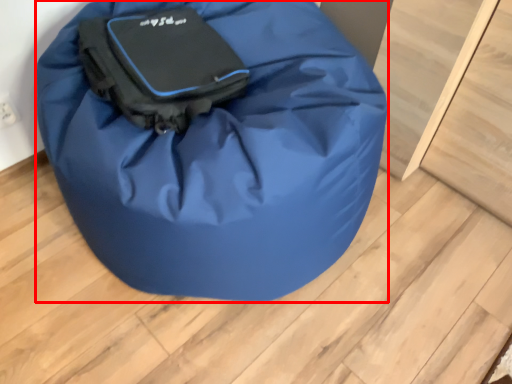
Question: In this image, where is luggage and bags (annotated by the red box) located relative to luggage and bags?

Choices:
 (A) left
 (B) right

Answer: (B)